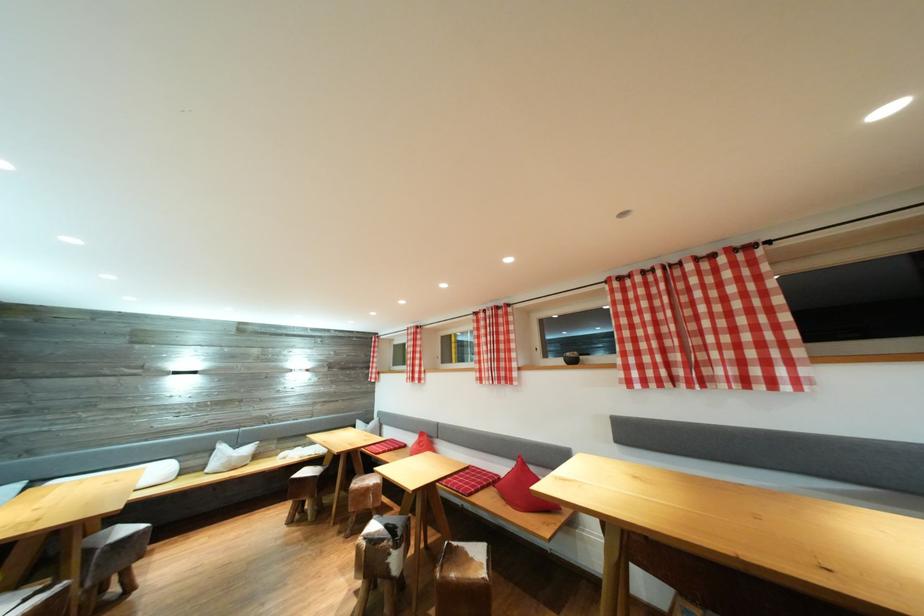
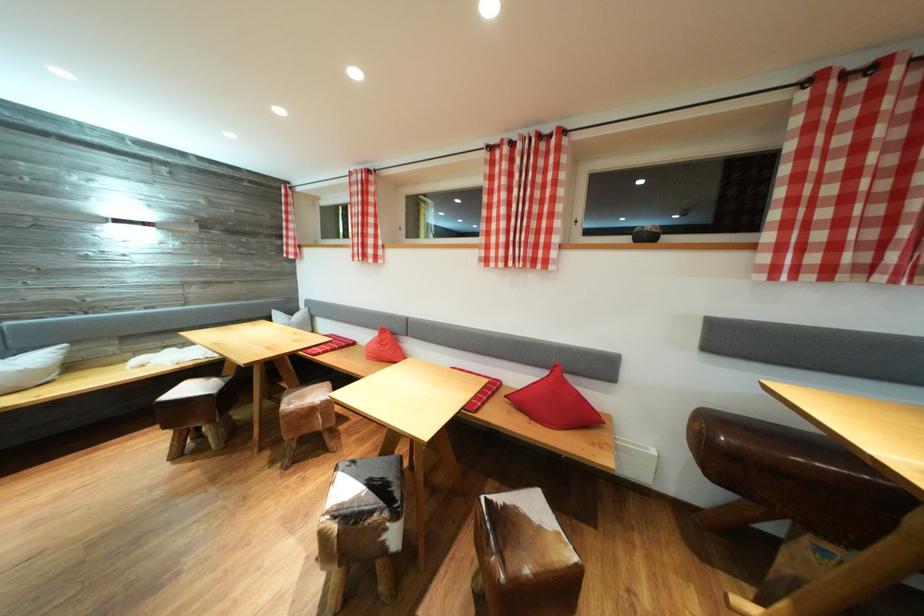
In the second image, find the point that corresponds to point 631,278 in the first image.

(869, 66)